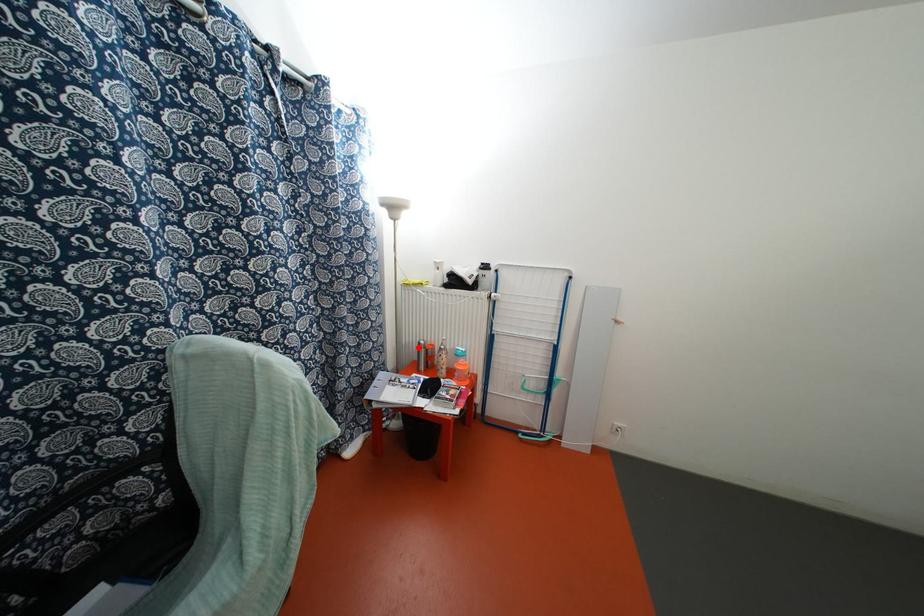
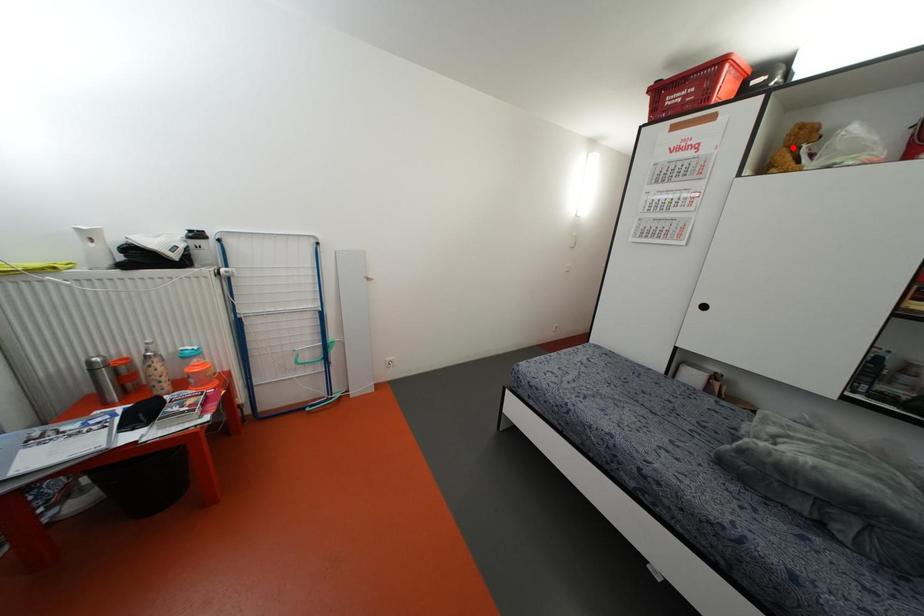
I am providing you with two images of the same scene from different viewpoints. A red point is marked on the first image and another point is marked on the second image. Does the point marked in image1 correspond to the same location as the one in image2?

No